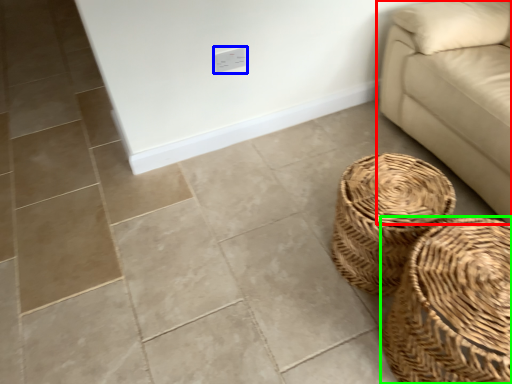
Question: Which is farther away from studio couch (highlighted by a red box)? electric outlet (highlighted by a blue box) or basket (highlighted by a green box)?

Choices:
 (A) electric outlet
 (B) basket

Answer: (A)